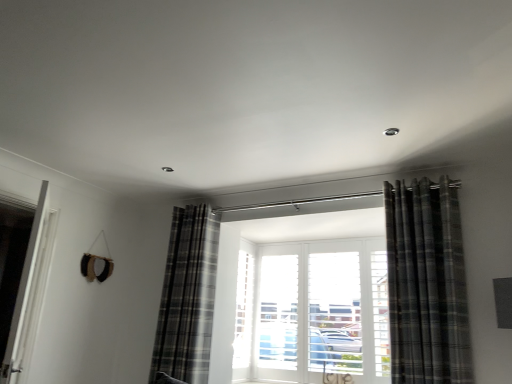
Measure the distance between white glossy door at left and camera.

white glossy door at left and camera are 2.04 meters apart.

In order to face plaid fabric curtain at center, the 2th curtain from the right, should I rotate leftwards or rightwards?

To align with it, rotate left about 10.087°.

This screenshot has height=384, width=512. I want to click on plaid fabric curtain at right, the 2th curtain in the back-to-front sequence, so click(x=426, y=284).

Image resolution: width=512 pixels, height=384 pixels. In order to click on white glossy door at left in this screenshot , I will do `click(24, 288)`.

From the image's perspective, is plaid fabric curtain at right, the 2th curtain in the back-to-front sequence, located above or below plaid fabric curtain at center, positioned as the first curtain in left-to-right order?

plaid fabric curtain at right, the 2th curtain in the back-to-front sequence, is situated higher than plaid fabric curtain at center, positioned as the first curtain in left-to-right order, in the image.

Is plaid fabric curtain at right, placed as the first curtain when sorted from right to left, in contact with plaid fabric curtain at center, which is the 1th curtain in back-to-front order?

No, plaid fabric curtain at right, placed as the first curtain when sorted from right to left, is not touching plaid fabric curtain at center, which is the 1th curtain in back-to-front order.

Does point (396, 224) appear closer or farther from the camera than point (216, 273)?

Point (396, 224) appears to be closer to the viewer than point (216, 273).

Considering the relative positions of plaid fabric curtain at right, the 2th curtain in the back-to-front sequence, and plaid fabric curtain at center, which is the 1th curtain in back-to-front order, in the image provided, is plaid fabric curtain at right, the 2th curtain in the back-to-front sequence, to the left or to the right of plaid fabric curtain at center, which is the 1th curtain in back-to-front order,?

In the image, plaid fabric curtain at right, the 2th curtain in the back-to-front sequence, appears on the right side of plaid fabric curtain at center, which is the 1th curtain in back-to-front order.

Is plaid fabric curtain at center, the 2th curtain from the right, with white glossy door at left?

They are not placed beside each other.

Can you tell me how much plaid fabric curtain at center, the second curtain when ordered from front to back, and white glossy door at left differ in facing direction?

35.5 degrees.

Which of these two, plaid fabric curtain at center, the second curtain when ordered from front to back, or white glossy door at left, is thinner?

white glossy door at left is thinner.

Is plaid fabric curtain at center, the second curtain when ordered from front to back, oriented away from white glossy door at left?

plaid fabric curtain at center, the second curtain when ordered from front to back, does not have its back to white glossy door at left.

Is plaid fabric curtain at center, which is the 1th curtain in back-to-front order, positioned behind plaid fabric curtain at right, placed as the first curtain when sorted from right to left?

Yes.

From a real-world perspective, is plaid fabric curtain at center, the 2th curtain from the right, on plaid fabric curtain at right, marked as the 1th curtain in a front-to-back arrangement?

No, from a real-world perspective, plaid fabric curtain at center, the 2th curtain from the right, is not above plaid fabric curtain at right, marked as the 1th curtain in a front-to-back arrangement.

From the picture: Is plaid fabric curtain at center, which is the 1th curtain in back-to-front order, bigger or smaller than plaid fabric curtain at right, marked as the 1th curtain in a front-to-back arrangement?

plaid fabric curtain at center, which is the 1th curtain in back-to-front order, is bigger than plaid fabric curtain at right, marked as the 1th curtain in a front-to-back arrangement.

Is plaid fabric curtain at center, positioned as the first curtain in left-to-right order, located outside plaid fabric curtain at right, placed as the first curtain when sorted from right to left?

Absolutely, plaid fabric curtain at center, positioned as the first curtain in left-to-right order, is external to plaid fabric curtain at right, placed as the first curtain when sorted from right to left.

Considering the points (28, 281) and (170, 346), which point is behind, point (28, 281) or point (170, 346)?

Positioned behind is point (170, 346).

From the image's perspective, which is above, white glossy door at left or plaid fabric curtain at center, the second curtain when ordered from front to back?

white glossy door at left appears higher in the image.

Is the depth of white glossy door at left less than that of plaid fabric curtain at center, the second curtain when ordered from front to back?

Yes, white glossy door at left is in front of plaid fabric curtain at center, the second curtain when ordered from front to back.

From a real-world perspective, relative to plaid fabric curtain at center, the second curtain when ordered from front to back, is white glossy door at left vertically above or below?

In terms of real-world spatial position, white glossy door at left is below plaid fabric curtain at center, the second curtain when ordered from front to back.

Relative to white glossy door at left, is plaid fabric curtain at right, marked as the 1th curtain in a front-to-back arrangement, in front or behind?

Visually, plaid fabric curtain at right, marked as the 1th curtain in a front-to-back arrangement, is located behind white glossy door at left.

Does plaid fabric curtain at right, the 2th curtain positioned from the left, have a lesser height compared to white glossy door at left?

No.

In the scene shown: Is white glossy door at left aimed at plaid fabric curtain at right, the 2th curtain positioned from the left?

No, white glossy door at left is not aimed at plaid fabric curtain at right, the 2th curtain positioned from the left.

Locate an element on the screen. This screenshot has width=512, height=384. the 1st curtain behind when counting from the white glossy door at left is located at coordinates (426, 284).

Is white glossy door at left located outside plaid fabric curtain at right, placed as the first curtain when sorted from right to left?

white glossy door at left is positioned outside plaid fabric curtain at right, placed as the first curtain when sorted from right to left.

Considering the relative sizes of white glossy door at left and plaid fabric curtain at right, placed as the first curtain when sorted from right to left, in the image provided, is white glossy door at left taller than plaid fabric curtain at right, placed as the first curtain when sorted from right to left,?

In fact, white glossy door at left may be shorter than plaid fabric curtain at right, placed as the first curtain when sorted from right to left.

This screenshot has width=512, height=384. I want to click on curtain that is behind the plaid fabric curtain at right, placed as the first curtain when sorted from right to left, so click(187, 297).

From a real-world perspective, starting from the white glossy door at left, which curtain is the 1st one vertically above it? Please provide its 2D coordinates.

[(187, 297)]

Which object lies nearer to the anchor point plaid fabric curtain at right, marked as the 1th curtain in a front-to-back arrangement, plaid fabric curtain at center, the 2th curtain from the right, or white glossy door at left?

Based on the image, plaid fabric curtain at center, the 2th curtain from the right, appears to be nearer to plaid fabric curtain at right, marked as the 1th curtain in a front-to-back arrangement.

Estimate the real-world distances between objects in this image. Which object is closer to white glossy door at left, plaid fabric curtain at center, the second curtain when ordered from front to back, or plaid fabric curtain at right, placed as the first curtain when sorted from right to left?

plaid fabric curtain at center, the second curtain when ordered from front to back, is closer to white glossy door at left.

Which object lies further to the anchor point plaid fabric curtain at center, the 2th curtain from the right, white glossy door at left or plaid fabric curtain at right, marked as the 1th curtain in a front-to-back arrangement?

plaid fabric curtain at right, marked as the 1th curtain in a front-to-back arrangement.

Based on their spatial positions, is plaid fabric curtain at right, the 2th curtain in the back-to-front sequence, or white glossy door at left closer to plaid fabric curtain at center, positioned as the first curtain in left-to-right order?

white glossy door at left is closer to plaid fabric curtain at center, positioned as the first curtain in left-to-right order.

When comparing their distances from white glossy door at left, does plaid fabric curtain at right, placed as the first curtain when sorted from right to left, or plaid fabric curtain at center, which is the 1th curtain in back-to-front order, seem further?

plaid fabric curtain at right, placed as the first curtain when sorted from right to left.

Looking at the image, which one is located further to plaid fabric curtain at right, the 2th curtain positioned from the left, white glossy door at left or plaid fabric curtain at center, the 2th curtain from the right?

white glossy door at left.

Locate an element on the screen. curtain between white glossy door at left and plaid fabric curtain at right, marked as the 1th curtain in a front-to-back arrangement, in the horizontal direction is located at coordinates (187, 297).